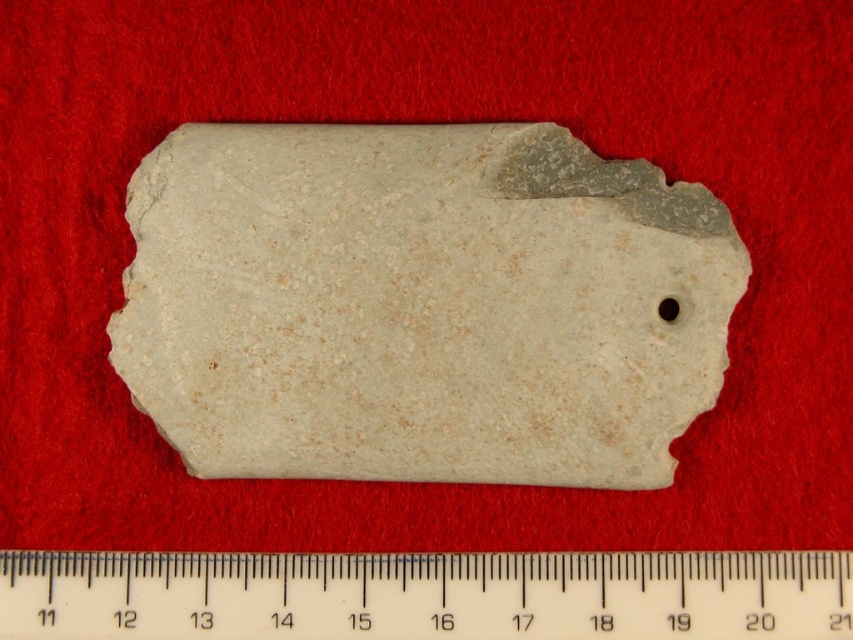
Can you confirm if white stone at center is positioned above white plastic ruler at bottom?

Correct, white stone at center is located above white plastic ruler at bottom.

Who is positioned more to the left, white stone at center or white plastic ruler at bottom?

Positioned to the left is white stone at center.

From the picture: Who is more forward, (670, 273) or (329, 573)?

Point (670, 273) is more forward.

The image size is (853, 640). Identify the location of white stone at center. coord(421,305).